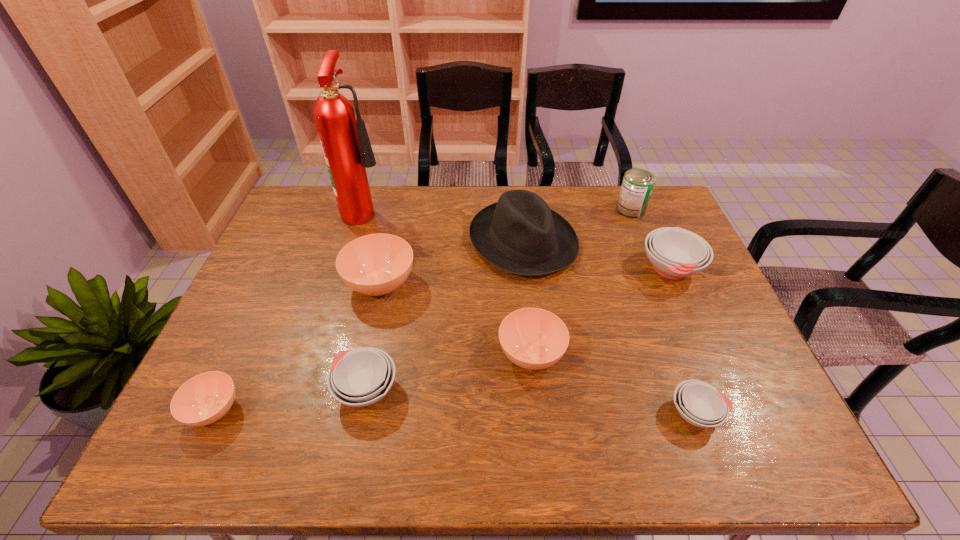
The image size is (960, 540). Identify the location of free space located on the back of the leftmost soup bowl. (254, 323).

The height and width of the screenshot is (540, 960). Identify the location of free space located 0.070m on the right of the smallest white soup bowl. (755, 413).

This screenshot has height=540, width=960. Identify the location of fire extinguisher that is at the far edge. (345, 142).

Locate an element on the screen. The width and height of the screenshot is (960, 540). fedora positioned at the far edge is located at coordinates (520, 234).

Where is `can that is at the far edge`? This screenshot has width=960, height=540. can that is at the far edge is located at coordinates (637, 185).

Locate an element on the screen. This screenshot has width=960, height=540. object that is at the left edge is located at coordinates (204, 399).

Where is `can located at the right edge`? This screenshot has height=540, width=960. can located at the right edge is located at coordinates (637, 185).

You are a GUI agent. You are given a task and a screenshot of the screen. Output one action in this format:
    pyautogui.click(x=<x>, y=<y>)
    Task: Click on the object that is positioned at the near left corner
    This screenshot has width=960, height=540.
    Given the screenshot: What is the action you would take?
    pyautogui.click(x=204, y=399)

Find the location of a particular element. object that is at the far right corner is located at coordinates tap(637, 185).

Locate an element on the screen. object at the near right corner is located at coordinates (700, 404).